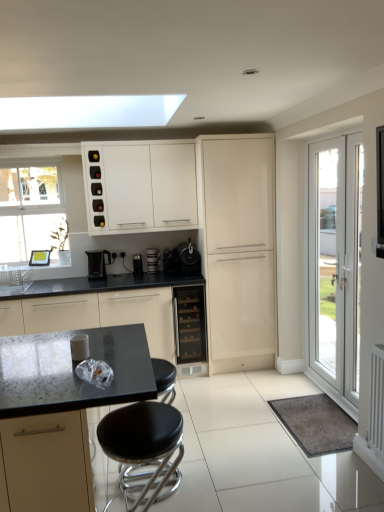
Question: Is white glossy door at right wider or thinner than black plastic coffee maker at center, marked as the 2th appliance in a right-to-left arrangement?

Choices:
 (A) thin
 (B) wide

Answer: (A)

Question: Is white glossy door at right in front of or behind black plastic coffee maker at center, marked as the 2th appliance in a right-to-left arrangement, in the image?

Choices:
 (A) behind
 (B) front

Answer: (B)

Question: Which is farther from the matte cream cabinet at center, the second cabinetry viewed from the back?

Choices:
 (A) black leather stool at center
 (B) white glossy door at right
 (C) black granite countertop at lower left, acting as the first cabinetry starting from the front
 (D) white glossy wine rack at upper center, which is counted as the 4th cabinetry, starting from the front
 (E) black matte coffee maker at center, the third appliance in the left-to-right sequence

Answer: (C)

Question: Estimate the real-world distances between objects in this image. Which object is farther from the metallic black coffee maker at center, which is counted as the 3th appliance, starting from the right?

Choices:
 (A) white glossy door at right
 (B) white plastic sink at upper left
 (C) matte cream cabinet at center, which ranks as the third cabinetry in front-to-back order
 (D) black granite countertop at lower left, positioned as the 4th cabinetry in back-to-front order
 (E) black granite countertop at lower left, acting as the second cabinetry starting from the front

Answer: (D)